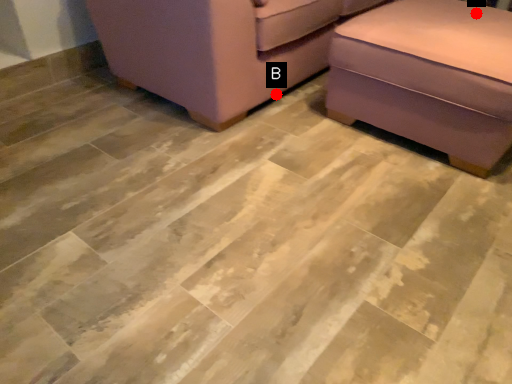
Question: Two points are circled on the image, labeled by A and B beside each circle. Which point is closer to the camera taking this photo?

Choices:
 (A) A is closer
 (B) B is closer

Answer: (A)